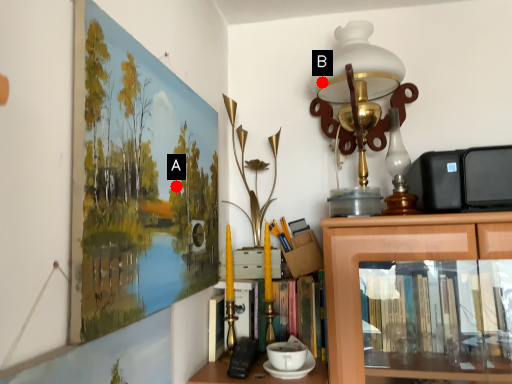
Question: Two points are circled on the image, labeled by A and B beside each circle. Which point is closer to the camera?

Choices:
 (A) A is closer
 (B) B is closer

Answer: (A)